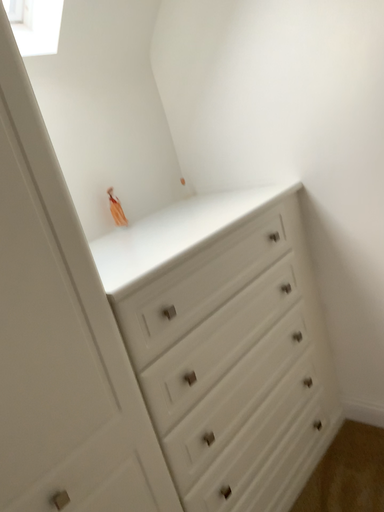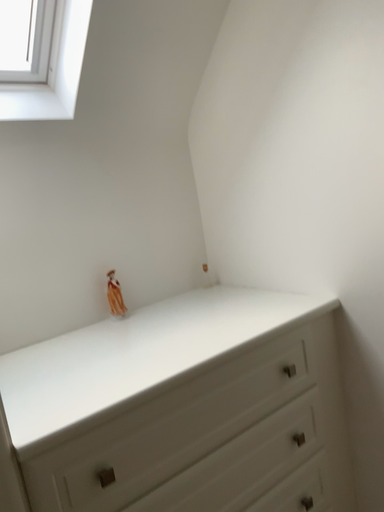
Question: How did the camera likely rotate when shooting the video?

Choices:
 (A) rotated upward
 (B) rotated downward

Answer: (A)